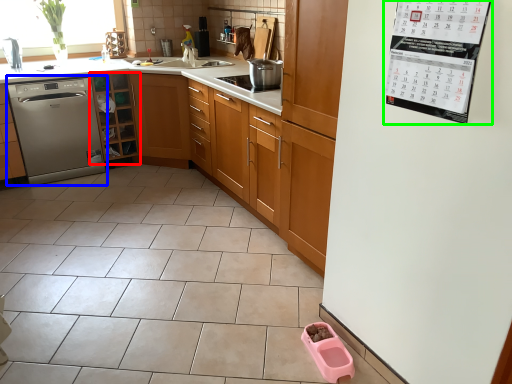
Question: Based on their relative distances, which object is farther from cabinetry (highlighted by a red box)? Choose from dishwasher (highlighted by a blue box) and bulletin board (highlighted by a green box).

Choices:
 (A) dishwasher
 (B) bulletin board

Answer: (B)